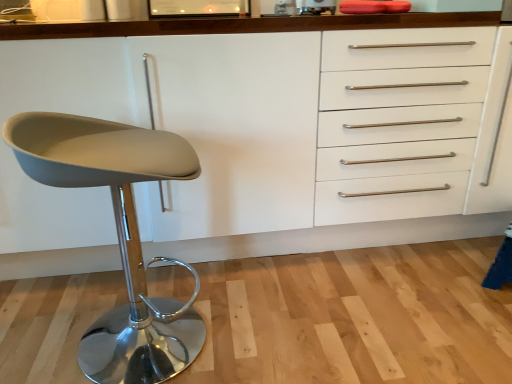
This screenshot has width=512, height=384. What do you see at coordinates (118, 235) in the screenshot? I see `matte gray seat at left` at bounding box center [118, 235].

Find the location of `matte gray seat at left`. matte gray seat at left is located at coordinates (118, 235).

This screenshot has width=512, height=384. I want to click on white wood cabinet at center, so click(x=322, y=136).

What do you see at coordinates (322, 136) in the screenshot?
I see `white wood cabinet at center` at bounding box center [322, 136].

Where is `matte gray seat at left`? matte gray seat at left is located at coordinates (118, 235).

Which object is positioned more to the left, white wood cabinet at center or matte gray seat at left?

From the viewer's perspective, matte gray seat at left appears more on the left side.

Considering the positions of objects white wood cabinet at center and matte gray seat at left in the image provided, who is in front, white wood cabinet at center or matte gray seat at left?

Positioned in front is matte gray seat at left.

Which is more distant, (60, 229) or (132, 283)?

Point (60, 229)

From the image's perspective, which is below, white wood cabinet at center or matte gray seat at left?

matte gray seat at left, from the image's perspective.

From a real-world perspective, which object stands above the other?

white wood cabinet at center, from a real-world perspective.

Looking at their sizes, would you say white wood cabinet at center is wider or thinner than matte gray seat at left?

Considering their sizes, white wood cabinet at center looks broader than matte gray seat at left.

Is white wood cabinet at center taller than matte gray seat at left?

Yes.

Between white wood cabinet at center and matte gray seat at left, which one has larger size?

With larger size is white wood cabinet at center.

Is white wood cabinet at center located outside matte gray seat at left?

Yes, white wood cabinet at center is not within matte gray seat at left.

Is white wood cabinet at center far from matte gray seat at left?

They are positioned close to each other.

Does white wood cabinet at center turn towards matte gray seat at left?

Yes, white wood cabinet at center faces towards matte gray seat at left.

Find the location of a particular element. Image resolution: width=512 pixels, height=384 pixels. chair that appears below the white wood cabinet at center (from the image's perspective) is located at coordinates (118, 235).

Between matte gray seat at left and white wood cabinet at center, which one appears on the left side from the viewer's perspective?

From the viewer's perspective, matte gray seat at left appears more on the left side.

Who is more distant, matte gray seat at left or white wood cabinet at center?

white wood cabinet at center is behind.

Is point (46, 180) positioned before point (334, 18)?

Yes, point (46, 180) is in front of point (334, 18).

From the image's perspective, is matte gray seat at left above white wood cabinet at center?

No, from the image's perspective, matte gray seat at left is not on top of white wood cabinet at center.

From a real-world perspective, between matte gray seat at left and white wood cabinet at center, who is vertically lower?

matte gray seat at left, from a real-world perspective.

Is matte gray seat at left wider than white wood cabinet at center?

In fact, matte gray seat at left might be narrower than white wood cabinet at center.

Who is shorter, matte gray seat at left or white wood cabinet at center?

With less height is matte gray seat at left.

Is matte gray seat at left bigger or smaller than white wood cabinet at center?

Clearly, matte gray seat at left is smaller in size than white wood cabinet at center.

Is matte gray seat at left positioned beyond the bounds of white wood cabinet at center?

matte gray seat at left is positioned outside white wood cabinet at center.

Is matte gray seat at left with white wood cabinet at center?

matte gray seat at left is not next to white wood cabinet at center, and they're not touching.

Does matte gray seat at left turn towards white wood cabinet at center?

No, matte gray seat at left is not aimed at white wood cabinet at center.

Can you tell me how much matte gray seat at left and white wood cabinet at center differ in facing direction?

99.2 degrees separate the facing orientations of matte gray seat at left and white wood cabinet at center.

The image size is (512, 384). I want to click on cabinetry behind the matte gray seat at left, so click(x=322, y=136).

Locate an element on the screen. chair that is in front of the white wood cabinet at center is located at coordinates (118, 235).

You are a GUI agent. You are given a task and a screenshot of the screen. Output one action in this format:
    pyautogui.click(x=<x>, y=<y>)
    Task: Click on the chair below the white wood cabinet at center (from the image's perspective)
    
    Given the screenshot: What is the action you would take?
    pyautogui.click(x=118, y=235)